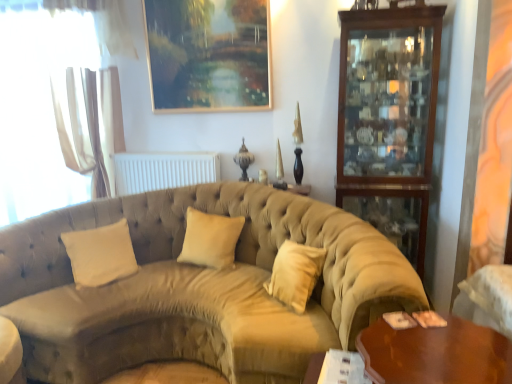
Question: From a real-world perspective, relative to mahogany wood cabinet at right, is shiny brown wooden table at lower right vertically above or below?

Choices:
 (A) above
 (B) below

Answer: (B)

Question: In terms of width, does shiny brown wooden table at lower right look wider or thinner when compared to mahogany wood cabinet at right?

Choices:
 (A) wide
 (B) thin

Answer: (A)

Question: Estimate the real-world distances between objects in this image. Which object is closer to the white sheer curtain at left?

Choices:
 (A) gold-framed painting at upper center
 (B) white fabric armchair at lower right
 (C) beige fabric pillow at center, the 1th pillow from the right
 (D) white velvet pillow at center, arranged as the first pillow when viewed from the left
 (E) white sheer curtain at left

Answer: (E)

Question: Based on their relative distances, which object is farther from the shiny brown wooden table at lower right?

Choices:
 (A) white sheer curtain at left
 (B) white fabric armchair at lower right
 (C) white velvet pillow at center, the 2th pillow viewed from the right
 (D) mahogany wood cabinet at right
 (E) beige fabric pillow at center, the 2th pillow viewed from the left

Answer: (A)